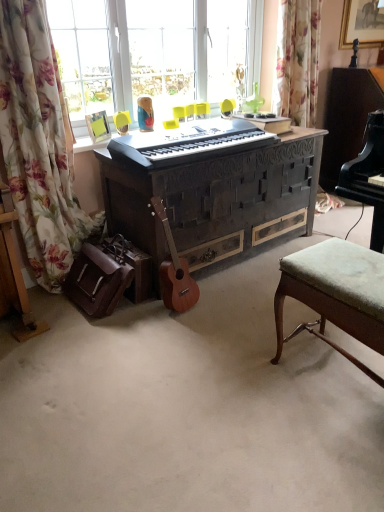
At what (x,y) coordinates should I click in order to perform the action: click on matte black keyboard at center. Please return your answer as a coordinate pair (x, y). Looking at the image, I should click on (188, 142).

Identify the location of floral fabric curtain at left. (39, 144).

In order to click on dark wood carved desk at center in this screenshot , I will do `click(216, 199)`.

Between floral fabric curtain at left and green fabric stool at lower right, which one has smaller width?

floral fabric curtain at left.

Is green fabric stool at lower right a part of floral fabric curtain at left?

Definitely not — green fabric stool at lower right is not inside floral fabric curtain at left.

Who is smaller, floral fabric curtain at left or green fabric stool at lower right?

green fabric stool at lower right.

Image resolution: width=384 pixels, height=512 pixels. I want to click on musical keyboard in front of the yellow plastic swivel chair at center, so click(x=188, y=142).

Is matte black keyboard at center to the left of yellow plastic swivel chair at center from the viewer's perspective?

Yes, matte black keyboard at center is to the left of yellow plastic swivel chair at center.

Does point (226, 129) appear closer or farther from the camera than point (227, 104)?

Clearly, point (226, 129) is closer to the camera than point (227, 104).

From a real-world perspective, is wooden acoustic guitar at lower left physically located above or below yellow plastic swivel chair at center?

Clearly, from a real-world perspective, wooden acoustic guitar at lower left is below yellow plastic swivel chair at center.

Which is less distant, (x=173, y=245) or (x=223, y=101)?

Point (x=173, y=245).

Is yellow plastic swivel chair at center located within wooden acoustic guitar at lower left?

No.

Is wooden acoustic guitar at lower left touching matte black keyboard at center?

No, wooden acoustic guitar at lower left is not making contact with matte black keyboard at center.

Identify the location of guitar on the left of the matte black keyboard at center. This screenshot has height=512, width=384. point(174,271).

Is wooden acoustic guitar at lower left at the right side of matte black keyboard at center?

In fact, wooden acoustic guitar at lower left is to the left of matte black keyboard at center.

From a real-world perspective, is wooden acoustic guitar at lower left over matte black keyboard at center?

Actually, wooden acoustic guitar at lower left is physically below matte black keyboard at center in the real world.

Does yellow plastic swivel chair at center appear on the left side of wooden acoustic guitar at lower left?

No.

Does point (226, 102) appear closer or farther from the camera than point (182, 287)?

Point (226, 102) is farther from the camera than point (182, 287).

Can you confirm if yellow plastic swivel chair at center is wider than wooden acoustic guitar at lower left?

In fact, yellow plastic swivel chair at center might be narrower than wooden acoustic guitar at lower left.

In the scene shown: In terms of width, does dark wood carved desk at center look wider or thinner when compared to floral fabric curtain at left?

In the image, dark wood carved desk at center appears to be wider than floral fabric curtain at left.

From a real-world perspective, which is physically below, dark wood carved desk at center or floral fabric curtain at left?

dark wood carved desk at center.

Could floral fabric curtain at left be considered to be inside dark wood carved desk at center?

No.

Would you say dark wood carved desk at center is to the left or to the right of floral fabric curtain at left in the picture?

dark wood carved desk at center is to the right of floral fabric curtain at left.

Identify the location of desk on the right of wooden acoustic guitar at lower left. (216, 199).

Is wooden acoustic guitar at lower left to the left of dark wood carved desk at center from the viewer's perspective?

Correct, you'll find wooden acoustic guitar at lower left to the left of dark wood carved desk at center.

How many degrees apart are the facing directions of wooden acoustic guitar at lower left and dark wood carved desk at center?

The facing directions of wooden acoustic guitar at lower left and dark wood carved desk at center are 0.475 degrees apart.

This screenshot has height=512, width=384. What are the coordinates of `stool in front of the floral fabric curtain at left` in the screenshot? It's located at (336, 293).

The image size is (384, 512). In order to click on swivel chair on the right side of matte black keyboard at center in this screenshot , I will do `click(227, 106)`.

Which object lies further to the anchor point floral fabric curtain at left, dark wood carved desk at center or matte black keyboard at center?

Based on the image, dark wood carved desk at center appears to be further to floral fabric curtain at left.

Estimate the real-world distances between objects in this image. Which object is further from matte black keyboard at center, wooden acoustic guitar at lower left or dark wood carved desk at center?

The object further to matte black keyboard at center is wooden acoustic guitar at lower left.

From the image, which object appears to be farther from yellow plastic swivel chair at center, wooden acoustic guitar at lower left or matte black keyboard at center?

wooden acoustic guitar at lower left is further to yellow plastic swivel chair at center.

From the image, which object appears to be nearer to green fabric stool at lower right, wooden acoustic guitar at lower left or matte black keyboard at center?

Result: Among the two, wooden acoustic guitar at lower left is located nearer to green fabric stool at lower right.

When comparing their distances from wooden acoustic guitar at lower left, does dark wood carved desk at center or yellow plastic swivel chair at center seem closer?

dark wood carved desk at center lies closer to wooden acoustic guitar at lower left than the other object.

Looking at the image, which one is located closer to wooden acoustic guitar at lower left, matte black keyboard at center or dark wood carved desk at center?

dark wood carved desk at center lies closer to wooden acoustic guitar at lower left than the other object.

In the scene shown: Looking at the image, which one is located further to dark wood carved desk at center, wooden acoustic guitar at lower left or green fabric stool at lower right?

Based on the image, green fabric stool at lower right appears to be further to dark wood carved desk at center.

Looking at the image, which one is located closer to yellow plastic swivel chair at center, matte black keyboard at center or dark wood carved desk at center?

The object closer to yellow plastic swivel chair at center is matte black keyboard at center.

Locate an element on the screen. Image resolution: width=384 pixels, height=512 pixels. desk between matte black keyboard at center and wooden acoustic guitar at lower left in the vertical direction is located at coordinates (216, 199).

Find the location of a particular element. The height and width of the screenshot is (512, 384). desk located between green fabric stool at lower right and yellow plastic swivel chair at center in the depth direction is located at coordinates 216,199.

I want to click on musical keyboard between floral fabric curtain at left and yellow plastic swivel chair at center in the front-back direction, so click(188, 142).

The height and width of the screenshot is (512, 384). I want to click on guitar located between green fabric stool at lower right and dark wood carved desk at center in the depth direction, so click(x=174, y=271).